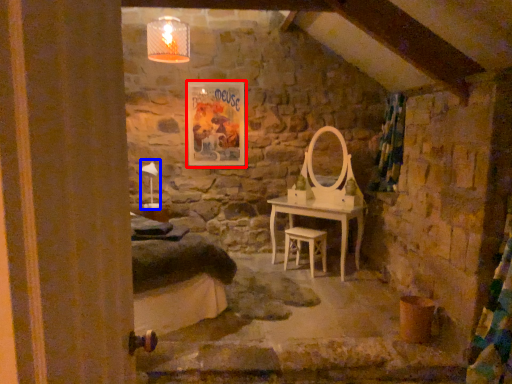
Question: Which of the following is the closest to the observer, picture frame (highlighted by a red box) or table lamp (highlighted by a blue box)?

Choices:
 (A) picture frame
 (B) table lamp

Answer: (B)